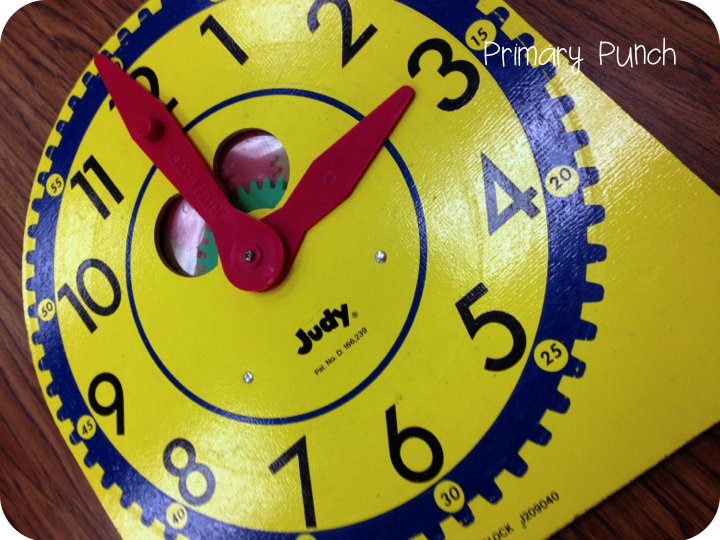
Where is `clock`? The image size is (720, 540). clock is located at coordinates (441, 192).